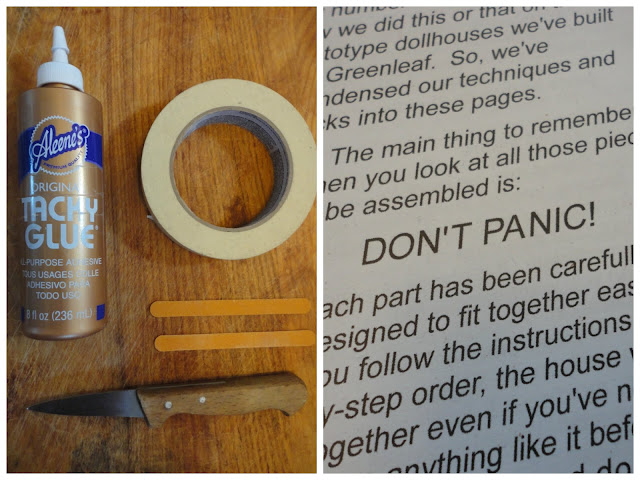
You are a GUI agent. You are given a task and a screenshot of the screen. Output one action in this format:
    pyautogui.click(x=<x>, y=<y>)
    Task: Click on the glue bottle
    The width and height of the screenshot is (640, 480).
    Given the screenshot: What is the action you would take?
    pyautogui.click(x=61, y=229)